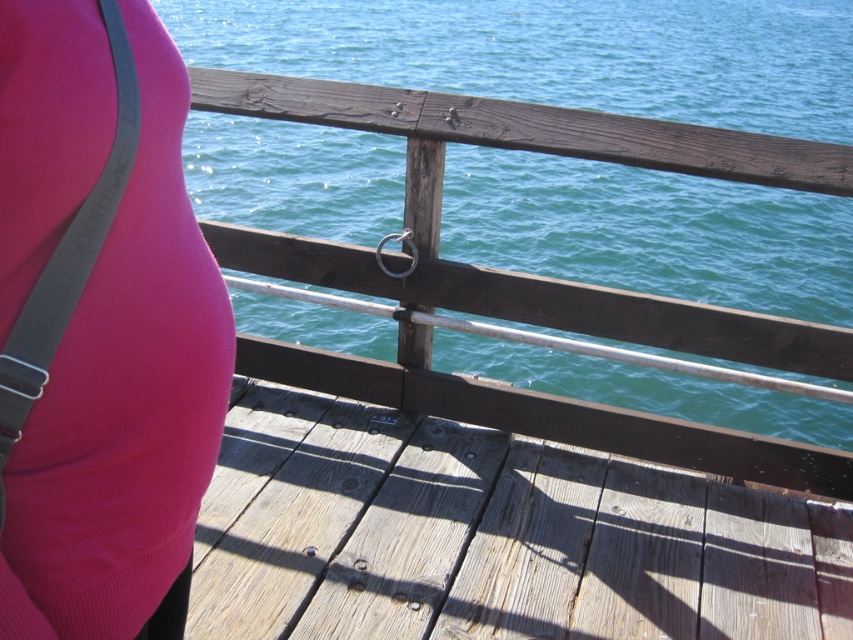
Question: Is weathered wood deck at center below matte pink fabric at center?

Choices:
 (A) no
 (B) yes

Answer: (B)

Question: Which point is closer to the camera?

Choices:
 (A) matte pink fabric at center
 (B) weathered wood deck at center
 (C) teal water at center

Answer: (A)

Question: Estimate the real-world distances between objects in this image. Which object is closer to the weathered wood deck at center?

Choices:
 (A) teal water at center
 (B) matte pink fabric at center

Answer: (B)

Question: Can you confirm if teal water at center is positioned to the left of matte pink fabric at center?

Choices:
 (A) yes
 (B) no

Answer: (B)

Question: Which object is positioned closest to the matte pink fabric at center?

Choices:
 (A) teal water at center
 (B) weathered wood deck at center

Answer: (B)

Question: Is teal water at center above matte pink fabric at center?

Choices:
 (A) no
 (B) yes

Answer: (B)